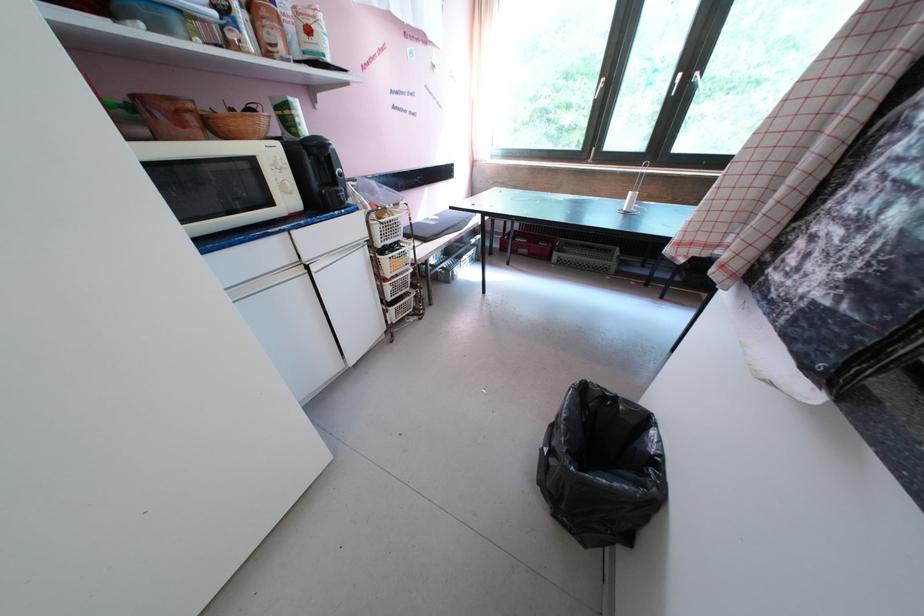
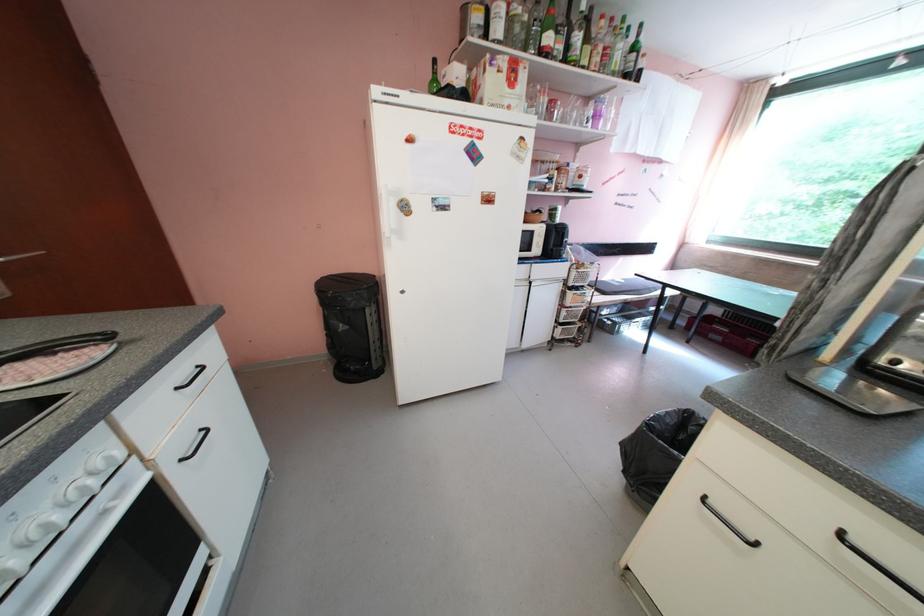
In the second image, find the point that corresponds to pixel 399 310 in the first image.

(568, 330)